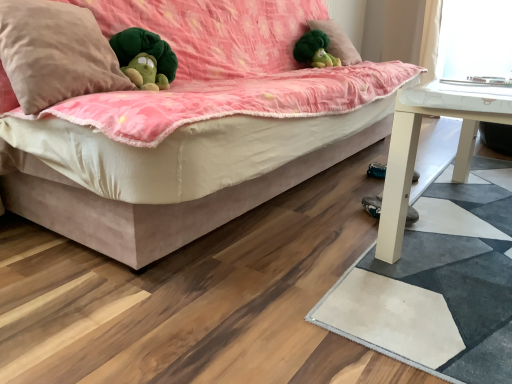
Question: From the image's perspective, relative to green plush at upper center, which appears as the second pillow when ordered from the bottom, is suede-like beige studio couch at center above or below?

Choices:
 (A) above
 (B) below

Answer: (B)

Question: Considering the positions of suede-like beige studio couch at center and green plush at upper center, the second pillow in the front-to-back sequence, in the image, is suede-like beige studio couch at center wider or thinner than green plush at upper center, the second pillow in the front-to-back sequence,?

Choices:
 (A) thin
 (B) wide

Answer: (B)

Question: Which object is the closest to the green plush toy at upper center?

Choices:
 (A) black suede shoe at lower right
 (B) beige soft pillow at upper left, which is the 1th pillow from front to back
 (C) white matte table at lower right
 (D) white matte mat at lower right
 (E) suede-like beige studio couch at center

Answer: (E)

Question: Based on their relative distances, which object is nearer to the black suede shoe at lower right?

Choices:
 (A) white matte mat at lower right
 (B) white matte table at lower right
 (C) green plush toy at upper center
 (D) green plush at upper center, arranged as the 2th pillow when viewed from the left
 (E) suede-like beige studio couch at center

Answer: (A)